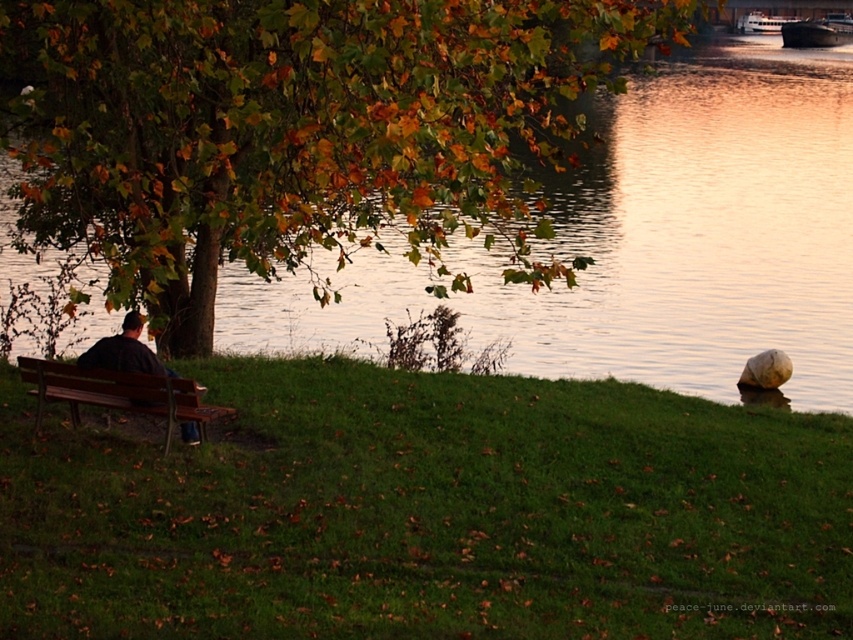
Can you confirm if brown wooden bench at lower left is shorter than dark brown wooden boat at upper right?

Indeed, brown wooden bench at lower left has a lesser height compared to dark brown wooden boat at upper right.

Which of these two, brown wooden bench at lower left or dark brown wooden boat at upper right, stands taller?

With more height is dark brown wooden boat at upper right.

Between point (120, 372) and point (840, 42), which one is positioned behind?

The point (840, 42) is behind.

Where is `brown wooden bench at lower left`? brown wooden bench at lower left is located at coordinates (120, 394).

Who is shorter, green leafy tree at upper left or white glossy boat at upper right?

white glossy boat at upper right

Based on the photo, which is above, green leafy tree at upper left or white glossy boat at upper right?

white glossy boat at upper right

The width and height of the screenshot is (853, 640). Describe the element at coordinates (297, 131) in the screenshot. I see `green leafy tree at upper left` at that location.

This screenshot has width=853, height=640. I want to click on green leafy tree at upper left, so click(x=297, y=131).

Between brown wooden bench at lower left and white glossy boat at upper right, which one appears on the right side from the viewer's perspective?

white glossy boat at upper right

Which is more to the left, brown wooden bench at lower left or white glossy boat at upper right?

From the viewer's perspective, brown wooden bench at lower left appears more on the left side.

Is point (16, 362) positioned after point (747, 33)?

No, (16, 362) is in front of (747, 33).

I want to click on brown wooden bench at lower left, so click(120, 394).